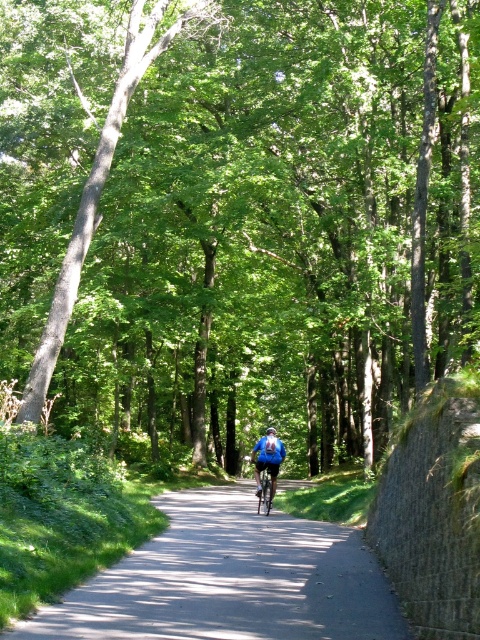
Between point (137, 552) and point (273, 429), which one is positioned behind?

The point (273, 429) is behind.

The width and height of the screenshot is (480, 640). Find the location of `smooth asphalt path at center`. smooth asphalt path at center is located at coordinates (229, 580).

Which is behind, point (354, 580) or point (267, 429)?

Positioned behind is point (267, 429).

Locate an element on the screen. smooth asphalt path at center is located at coordinates (229, 580).

Which of these two, green leafy tree at center or smooth asphalt path at center, stands shorter?

smooth asphalt path at center is shorter.

Is green leafy tree at center to the right of smooth asphalt path at center from the viewer's perspective?

Incorrect, green leafy tree at center is not on the right side of smooth asphalt path at center.

Between point (108, 177) and point (262, 570), which one is positioned in front?

Point (262, 570) is in front.

Identify the location of green leafy tree at center. The height and width of the screenshot is (640, 480). (238, 218).

Is smooth asphalt path at center above blue fabric jacket at center?

Yes, smooth asphalt path at center is above blue fabric jacket at center.

Consider the image. Who is more distant from viewer, (x=339, y=621) or (x=274, y=442)?

The point (x=274, y=442) is behind.

Who is more distant from viewer, [290,481] or [274,444]?

The point [290,481] is behind.

The image size is (480, 640). What are the coordinates of `smooth asphalt path at center` in the screenshot? It's located at (229, 580).